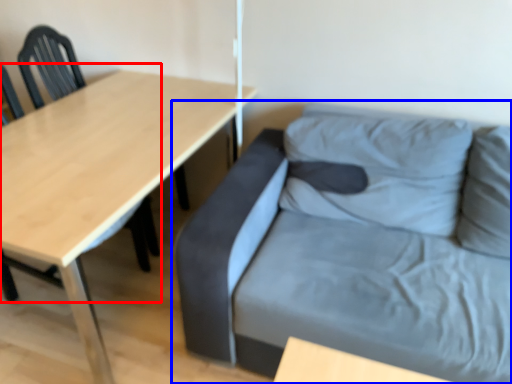
Question: Which of the following is the farthest to the observer, chair (highlighted by a red box) or studio couch (highlighted by a blue box)?

Choices:
 (A) chair
 (B) studio couch

Answer: (A)